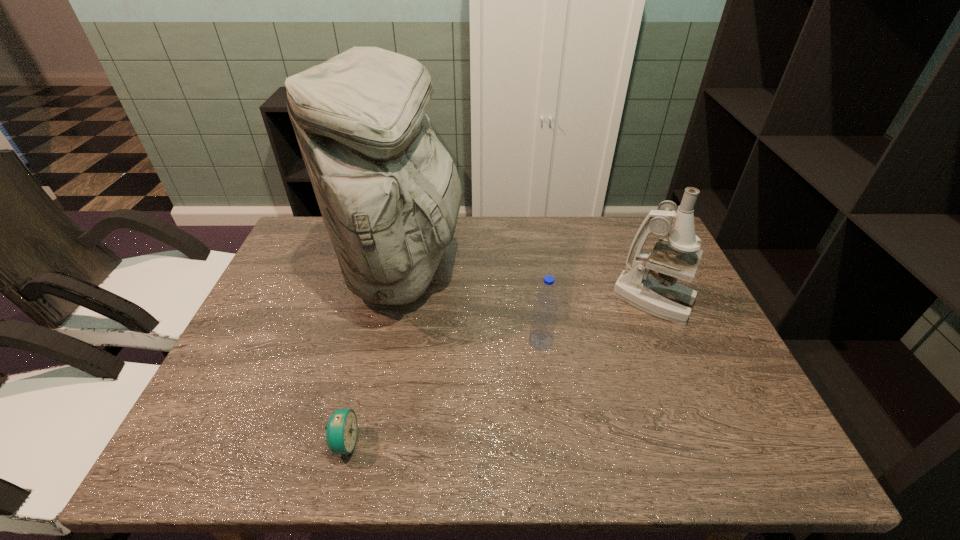
Identify the location of backpack. The width and height of the screenshot is (960, 540). (389, 193).

Image resolution: width=960 pixels, height=540 pixels. I want to click on microscope, so click(x=658, y=294).

The image size is (960, 540). In order to click on the second tallest object in this screenshot , I will do `click(658, 294)`.

The image size is (960, 540). Identify the location of the third object from left to right. (543, 321).

At what (x,y) coordinates should I click in order to perform the action: click on water bottle. Please return your answer as a coordinate pair (x, y). Looking at the image, I should click on (543, 321).

At what (x,y) coordinates should I click in order to perform the action: click on the shortest object. Please return your answer as a coordinate pair (x, y). Looking at the image, I should click on (341, 431).

Where is `the nearest object`? This screenshot has height=540, width=960. the nearest object is located at coordinates (341, 431).

The image size is (960, 540). What are the coordinates of `vacant region located on the front-facing side of the backpack` in the screenshot? It's located at (484, 271).

The image size is (960, 540). I want to click on vacant space positioned 0.380m on the left of the microscope, so click(x=474, y=301).

The image size is (960, 540). In order to click on vacant space located on the back of the third tallest object in this screenshot , I will do `click(533, 278)`.